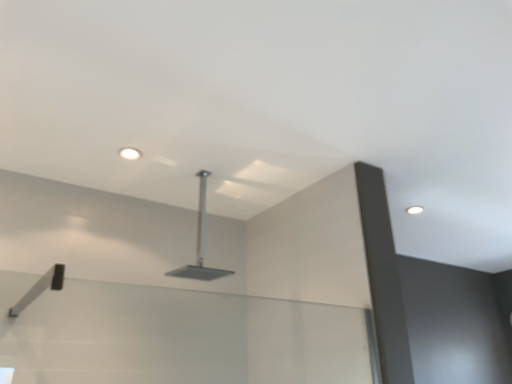
Question: Choose the correct answer: Is satin silver showerhead at center inside white glossy droplight at upper right, which is the 1th droplight from bottom to top, or outside it?

Choices:
 (A) outside
 (B) inside

Answer: (A)

Question: In the image, is satin silver showerhead at center on the left side or the right side of white glossy droplight at upper right, which ranks as the 1th droplight in back-to-front order?

Choices:
 (A) left
 (B) right

Answer: (A)

Question: Which is nearer to the satin silver showerhead at center?

Choices:
 (A) white glossy droplight at upper right, which is the 1th droplight from bottom to top
 (B) matte white droplight at upper center, which ranks as the 1th droplight in front-to-back order

Answer: (B)

Question: Based on their relative distances, which object is farther from the white glossy droplight at upper right, positioned as the second droplight in top-to-bottom order?

Choices:
 (A) matte white droplight at upper center, placed as the 1th droplight when sorted from left to right
 (B) satin silver showerhead at center

Answer: (A)